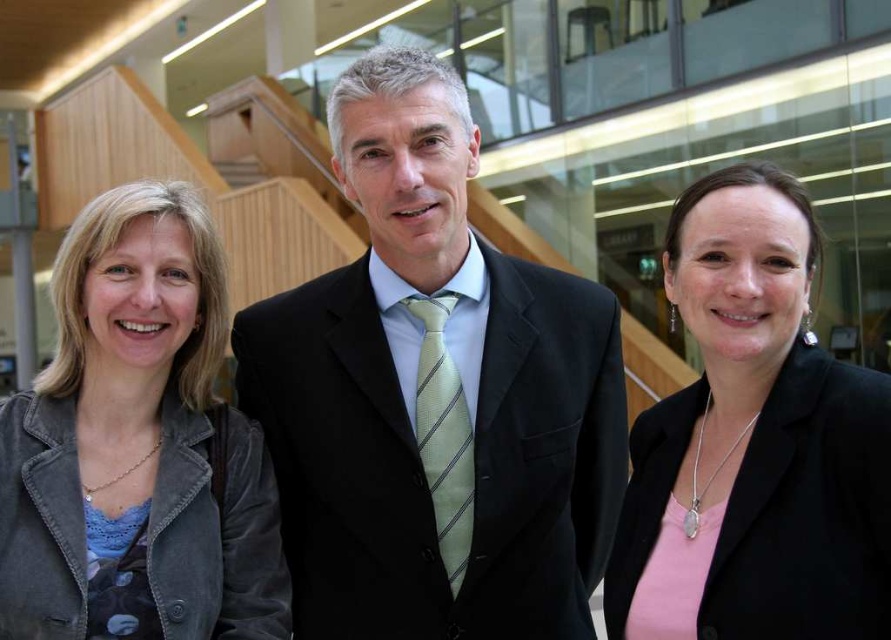
Question: Is black suit at center to the right of pink matte blazer at center from the viewer's perspective?

Choices:
 (A) no
 (B) yes

Answer: (A)

Question: Which point is farther from the camera taking this photo?

Choices:
 (A) (423, 609)
 (B) (840, 579)
 (C) (120, 532)

Answer: (A)

Question: Which of the following is the closest to the observer?

Choices:
 (A) pink matte blazer at center
 (B) denim jacket at left

Answer: (A)

Question: Is denim jacket at left in front of pink matte blazer at center?

Choices:
 (A) yes
 (B) no

Answer: (B)

Question: Is the position of black suit at center less distant than that of denim jacket at left?

Choices:
 (A) yes
 (B) no

Answer: (B)

Question: Considering the real-world distances, which object is farthest from the denim jacket at left?

Choices:
 (A) black suit at center
 (B) pink matte blazer at center

Answer: (B)